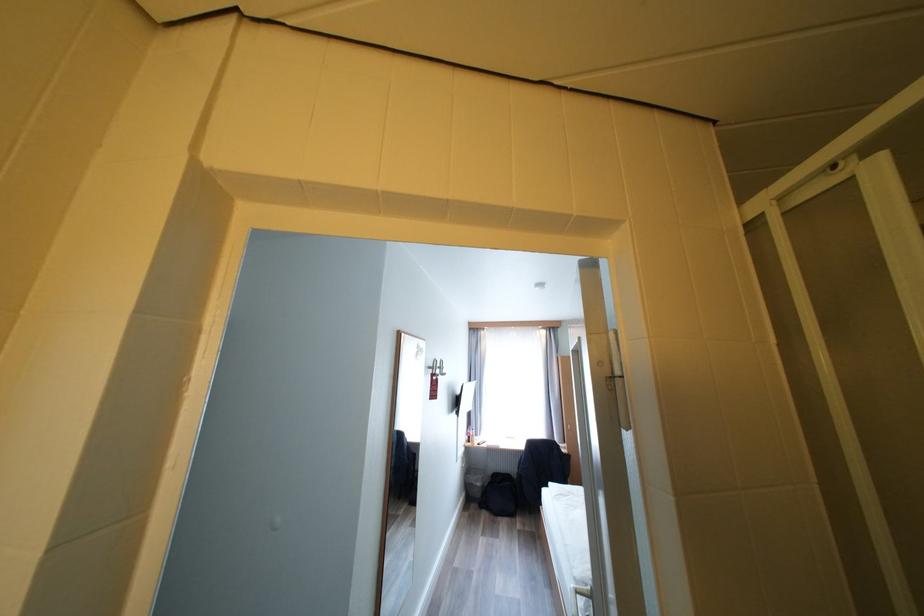
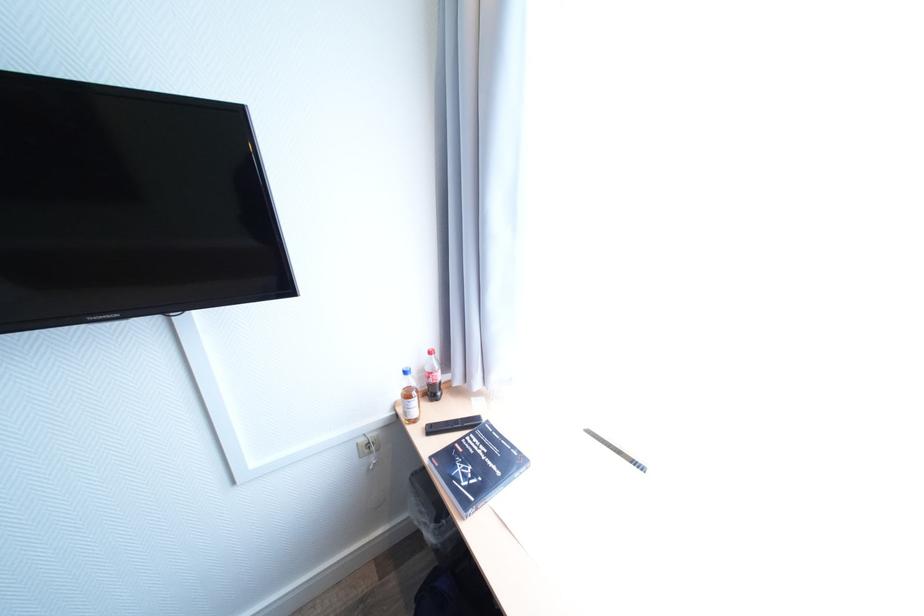
Locate, in the second image, the point that corresponds to (485,446) in the first image.

(439, 430)